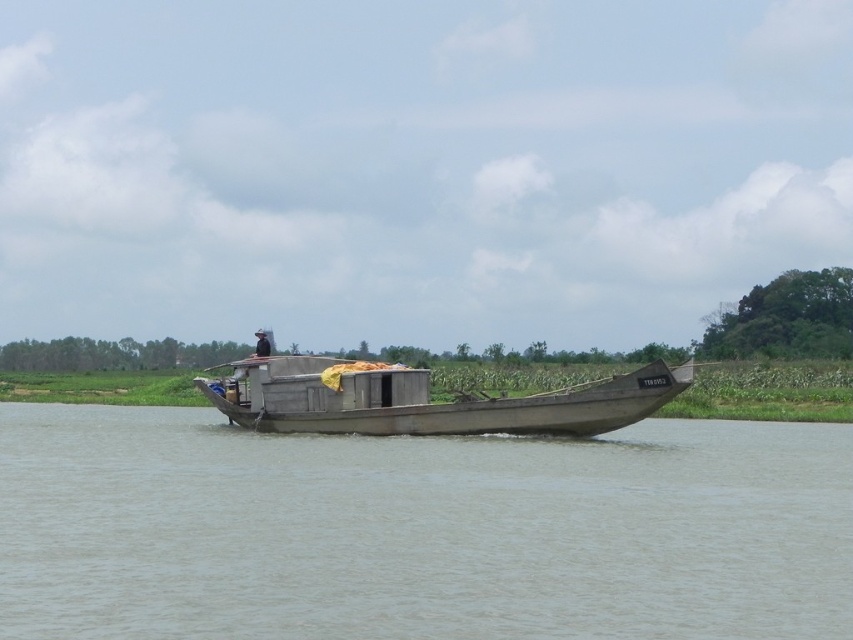
Is the position of gray wooden boat at center less distant than that of wooden boat at center?

Yes.

Between gray wooden boat at center and wooden boat at center, which one is positioned lower?

gray wooden boat at center is lower down.

I want to click on gray wooden boat at center, so click(418, 531).